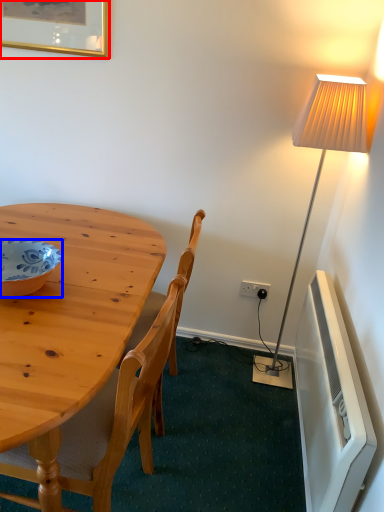
Question: Which of the following is the closest to the observer, picture frame (highlighted by a red box) or bowl (highlighted by a blue box)?

Choices:
 (A) picture frame
 (B) bowl

Answer: (B)